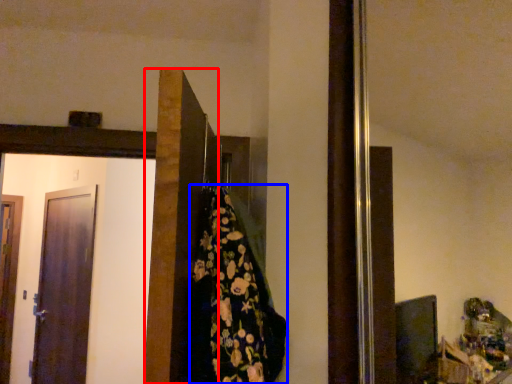
Question: Which of the following is the closest to the observer, door (highlighted by a red box) or blanket (highlighted by a blue box)?

Choices:
 (A) door
 (B) blanket

Answer: (A)